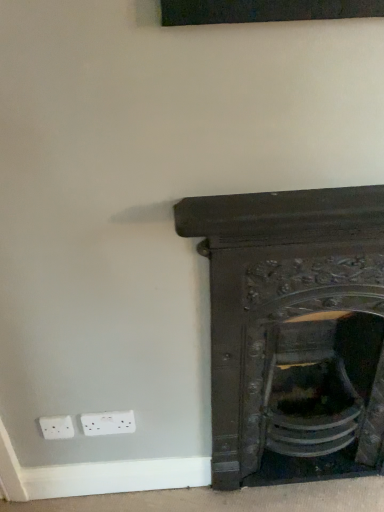
Question: Considering the relative sizes of white plastic electric outlet at lower left and dark wood fireplace at lower right in the image provided, is white plastic electric outlet at lower left bigger than dark wood fireplace at lower right?

Choices:
 (A) no
 (B) yes

Answer: (A)

Question: Would you say white plastic electric outlet at lower left is outside dark wood fireplace at lower right?

Choices:
 (A) no
 (B) yes

Answer: (B)

Question: Is white plastic electric outlet at lower left positioned before dark wood fireplace at lower right?

Choices:
 (A) no
 (B) yes

Answer: (A)

Question: From the image's perspective, does white plastic electric outlet at lower left appear lower than dark wood fireplace at lower right?

Choices:
 (A) no
 (B) yes

Answer: (B)

Question: Can you confirm if white plastic electric outlet at lower left is positioned to the left of dark wood fireplace at lower right?

Choices:
 (A) no
 (B) yes

Answer: (B)

Question: From a real-world perspective, does white plastic electric outlet at lower left stand above dark wood fireplace at lower right?

Choices:
 (A) yes
 (B) no

Answer: (B)

Question: From a real-world perspective, is dark wood fireplace at lower right on white plastic electric outlet at lower left?

Choices:
 (A) no
 (B) yes

Answer: (B)

Question: Is dark wood fireplace at lower right at the right side of white plastic electric outlet at lower left?

Choices:
 (A) no
 (B) yes

Answer: (B)

Question: Can you confirm if dark wood fireplace at lower right is thinner than white plastic electric outlet at lower left?

Choices:
 (A) yes
 (B) no

Answer: (B)

Question: From the image's perspective, is dark wood fireplace at lower right under white plastic electric outlet at lower left?

Choices:
 (A) yes
 (B) no

Answer: (B)

Question: Considering the relative positions of dark wood fireplace at lower right and white plastic electric outlet at lower left in the image provided, is dark wood fireplace at lower right to the left of white plastic electric outlet at lower left from the viewer's perspective?

Choices:
 (A) yes
 (B) no

Answer: (B)

Question: Can you see dark wood fireplace at lower right touching white plastic electric outlet at lower left?

Choices:
 (A) yes
 (B) no

Answer: (B)

Question: Is dark wood fireplace at lower right wider or thinner than white plastic electric outlet at lower left?

Choices:
 (A) thin
 (B) wide

Answer: (B)